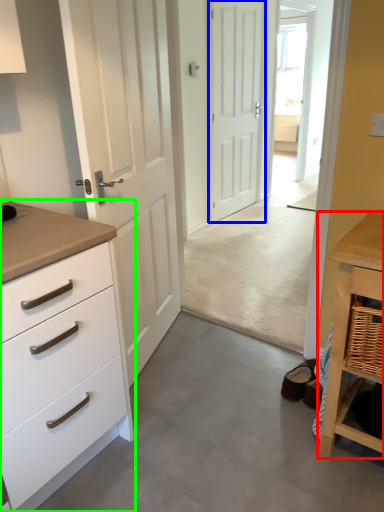
Question: Which is farther away from table (highlighted by a red box)? door (highlighted by a blue box) or chest of drawers (highlighted by a green box)?

Choices:
 (A) door
 (B) chest of drawers

Answer: (A)